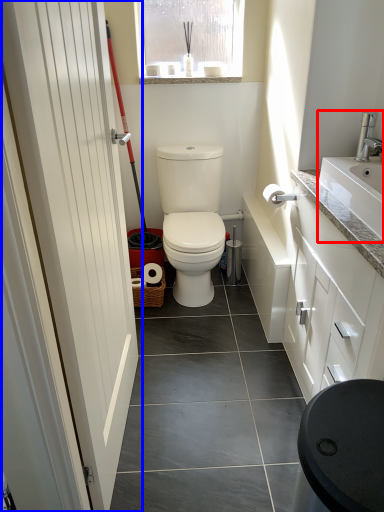
Question: Which object is closer to the camera taking this photo, sink (highlighted by a red box) or door (highlighted by a blue box)?

Choices:
 (A) sink
 (B) door

Answer: (B)